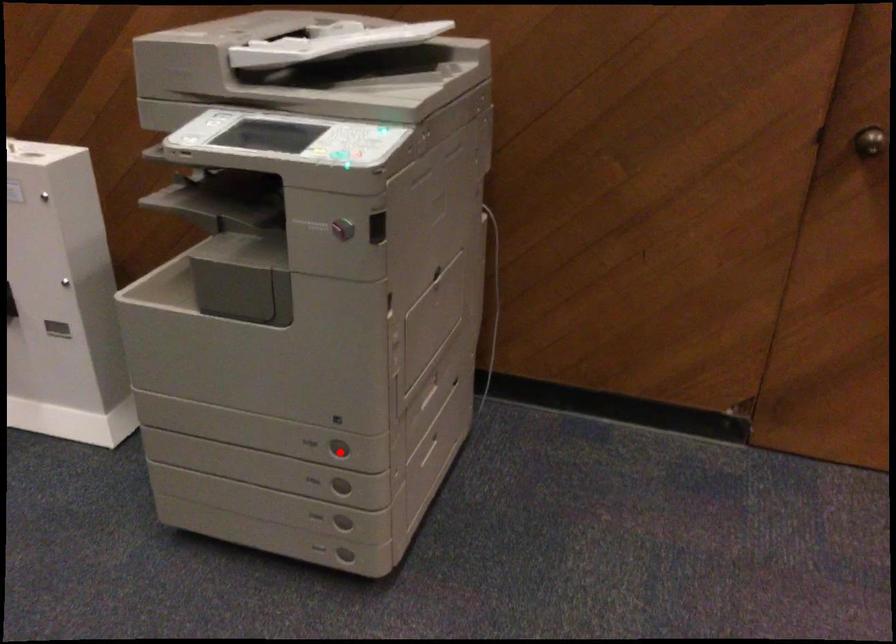
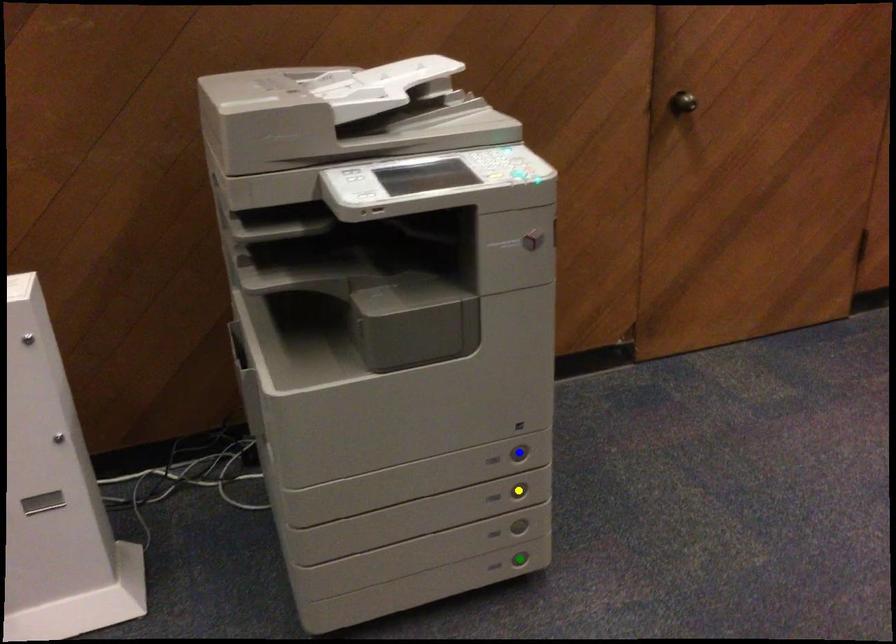
Question: I am providing you with two images of the same scene from different viewpoints. A red point is marked on the first image. You are given multiple points on the second image. Which spot in image 2 lines up with the point in image 1?

Choices:
 (A) yellow point
 (B) blue point
 (C) green point

Answer: (B)